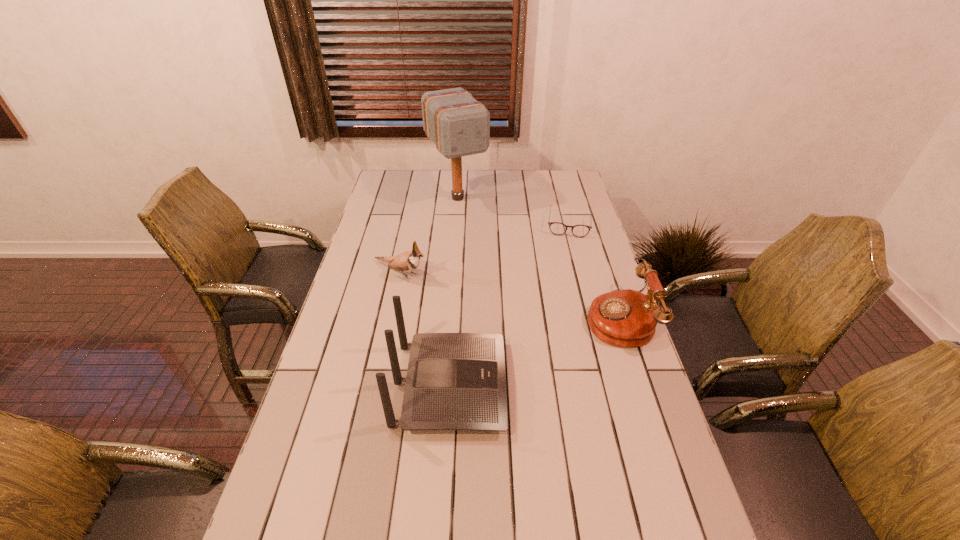
Locate an element on the screen. This screenshot has width=960, height=540. free spot on the desktop that is between the router and the telephone and is positioned on the striking surface of the tallest object is located at coordinates (562, 341).

Locate an element on the screen. The height and width of the screenshot is (540, 960). free spot on the desktop that is between the second tallest object and the telephone and is positioned at the face of the bird is located at coordinates (550, 346).

Where is `free spot on the desktop that is between the router and the telephone and is positioned through the lenses of the spectacles`? free spot on the desktop that is between the router and the telephone and is positioned through the lenses of the spectacles is located at coordinates (563, 341).